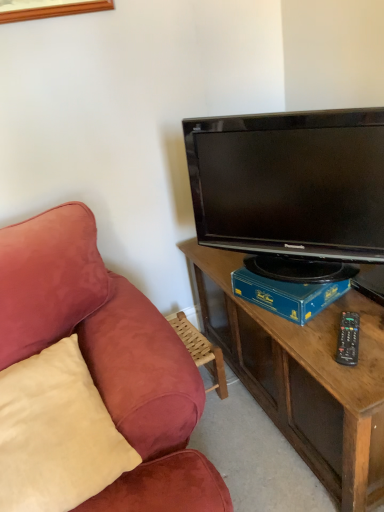
Question: Can you confirm if beige suede pillow at left is thinner than black glossy tv at upper right?

Choices:
 (A) yes
 (B) no

Answer: (B)

Question: Is beige suede pillow at left at the left side of black glossy tv at upper right?

Choices:
 (A) no
 (B) yes

Answer: (B)

Question: Does beige suede pillow at left lie in front of black glossy tv at upper right?

Choices:
 (A) yes
 (B) no

Answer: (A)

Question: Does beige suede pillow at left appear on the right side of black glossy tv at upper right?

Choices:
 (A) no
 (B) yes

Answer: (A)

Question: Is beige suede pillow at left wider than black glossy tv at upper right?

Choices:
 (A) yes
 (B) no

Answer: (A)

Question: Could you tell me if beige suede pillow at left is facing black glossy tv at upper right?

Choices:
 (A) no
 (B) yes

Answer: (A)

Question: Is blue cardboard box at center facing away from beige suede pillow at left?

Choices:
 (A) no
 (B) yes

Answer: (A)

Question: From a real-world perspective, does blue cardboard box at center sit lower than beige suede pillow at left?

Choices:
 (A) no
 (B) yes

Answer: (A)

Question: Is beige suede pillow at left surrounded by blue cardboard box at center?

Choices:
 (A) yes
 (B) no

Answer: (B)

Question: Can you confirm if blue cardboard box at center is smaller than beige suede pillow at left?

Choices:
 (A) yes
 (B) no

Answer: (A)

Question: Is blue cardboard box at center thinner than beige suede pillow at left?

Choices:
 (A) yes
 (B) no

Answer: (A)

Question: Considering the relative sizes of blue cardboard box at center and beige suede pillow at left in the image provided, is blue cardboard box at center shorter than beige suede pillow at left?

Choices:
 (A) no
 (B) yes

Answer: (B)

Question: Is black plastic remote control at right completely or partially outside of black glossy tv at upper right?

Choices:
 (A) no
 (B) yes

Answer: (B)